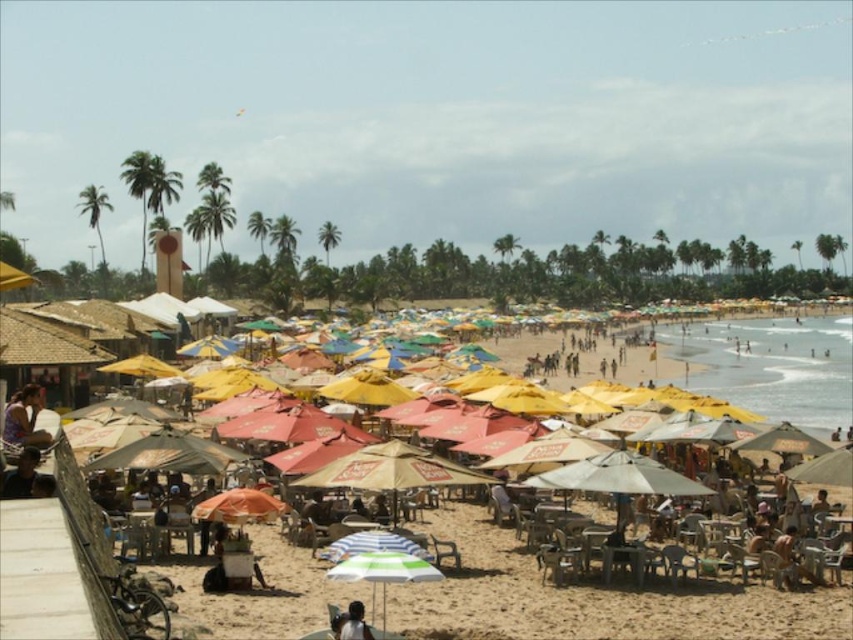
Does beige fabric umbrellas at center lie behind matte black shirt at lower left?

Yes.

Can you confirm if beige fabric umbrellas at center is positioned below matte black shirt at lower left?

No, beige fabric umbrellas at center is not below matte black shirt at lower left.

Is point (509, 573) positioned behind point (33, 433)?

Yes, point (509, 573) is behind point (33, 433).

Identify the location of beige fabric umbrellas at center. (590, 596).

Based on the photo, can you confirm if dark brown leather bag at lower center is positioned to the left of green leafy palm tree at center?

No, dark brown leather bag at lower center is not to the left of green leafy palm tree at center.

Is dark brown leather bag at lower center taller than green leafy palm tree at center?

Incorrect, dark brown leather bag at lower center's height is not larger of green leafy palm tree at center's.

Is point (366, 632) farther from viewer compared to point (328, 220)?

No, it is not.

I want to click on dark brown leather bag at lower center, so click(354, 624).

Between matte black shirt at lower left and green leafy palm tree at center, which one has more height?

green leafy palm tree at center is taller.

Find the location of a particular element. This screenshot has width=853, height=640. matte black shirt at lower left is located at coordinates (22, 420).

I want to click on matte black shirt at lower left, so click(22, 420).